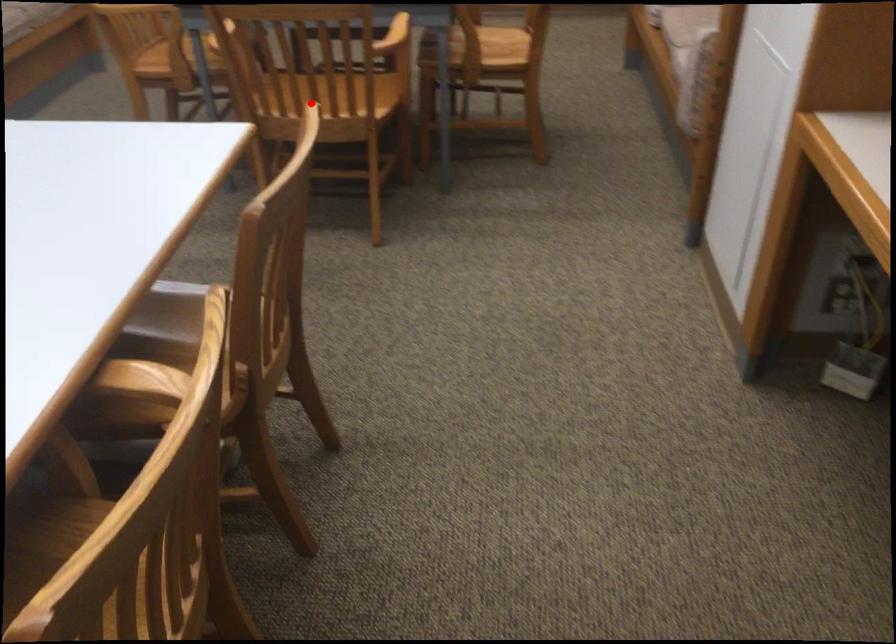
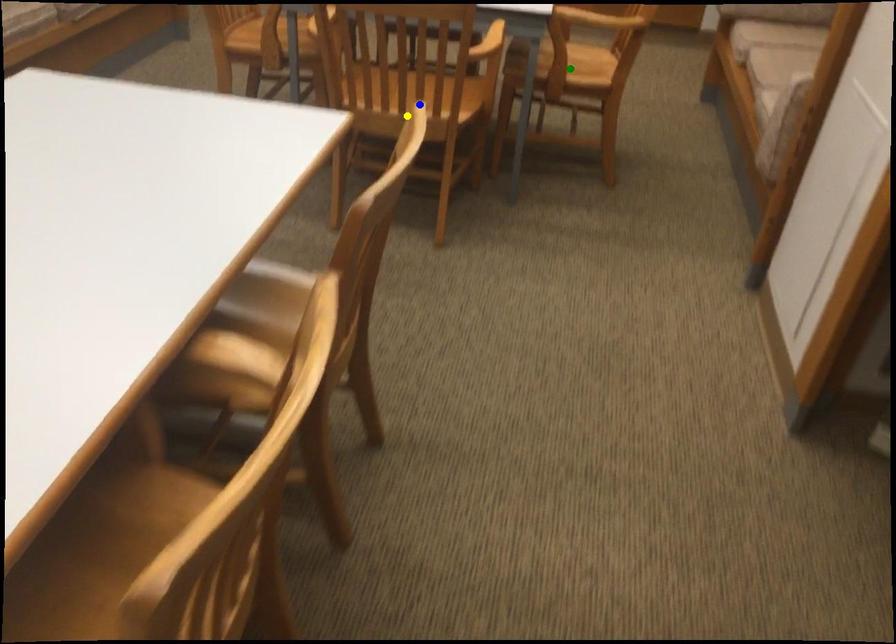
Question: I am providing you with two images of the same scene from different viewpoints. A red point is marked on the first image. You are given multiple points on the second image. Which point in image 2 represents the same 3d spot as the red point in image 1?

Choices:
 (A) yellow point
 (B) green point
 (C) blue point

Answer: (C)